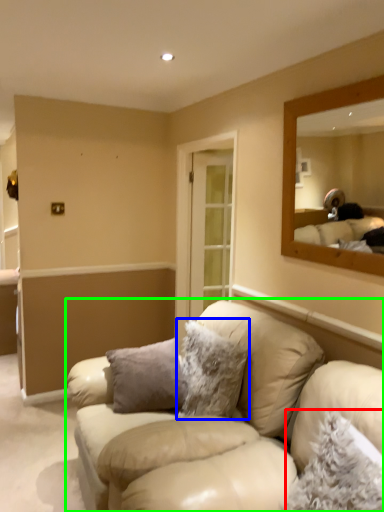
Question: Which object is the closest to the pillow (highlighted by a red box)? Choose among these: pillow (highlighted by a blue box) or studio couch (highlighted by a green box).

Choices:
 (A) pillow
 (B) studio couch

Answer: (B)